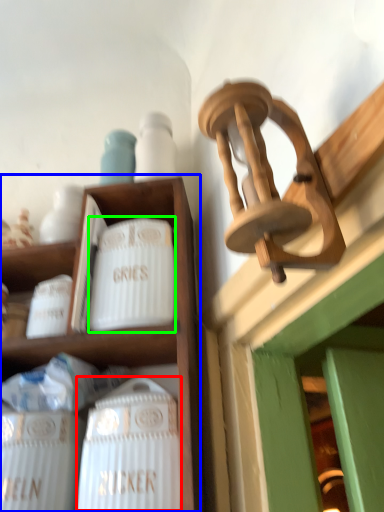
Question: Which object is positioned closest to wine bottle (highlighted by a red box)? Select from shelf (highlighted by a blue box) and pottery (highlighted by a green box).

Choices:
 (A) shelf
 (B) pottery

Answer: (A)